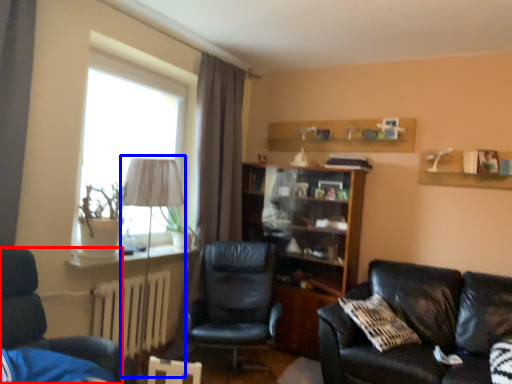
Question: Which point is further to the camera, chair (highlighted by a red box) or table lamp (highlighted by a blue box)?

Choices:
 (A) chair
 (B) table lamp

Answer: (B)